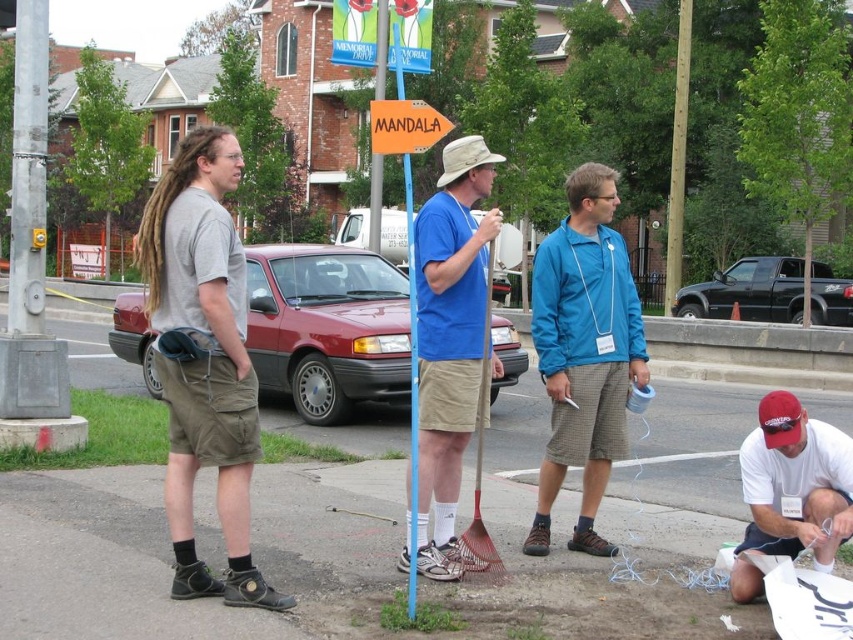
Question: Which object is positioned farthest from the gray cotton t-shirt at left?

Choices:
 (A) smooth wooden pole at upper right
 (B) white matte t-shirt at lower right
 (C) blue t-shirt at center

Answer: (A)

Question: Is white matte t-shirt at lower right to the left of orange plastic sign at center from the viewer's perspective?

Choices:
 (A) no
 (B) yes

Answer: (A)

Question: Does blue textured jacket at center appear on the right side of orange plastic signpost at center?

Choices:
 (A) yes
 (B) no

Answer: (A)

Question: Can you confirm if blue textured jacket at center is smaller than orange plastic signpost at center?

Choices:
 (A) yes
 (B) no

Answer: (A)

Question: Which point appears farthest from the camera in this image?

Choices:
 (A) (637, 385)
 (B) (430, 140)

Answer: (A)

Question: Which object appears closest to the camera in this image?

Choices:
 (A) blue textured jacket at center
 (B) gray cotton t-shirt at left

Answer: (B)